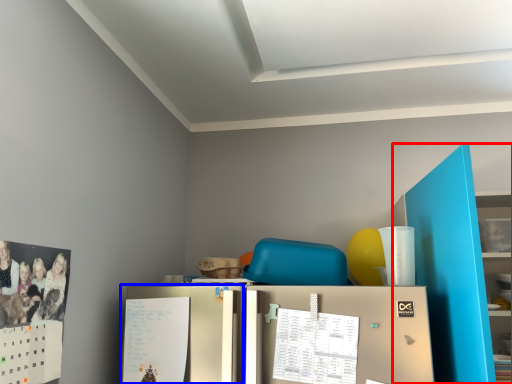
Question: Which object appears farthest to the camera in this image, bookshelf (highlighted by a red box) or fridge (highlighted by a blue box)?

Choices:
 (A) bookshelf
 (B) fridge

Answer: (B)